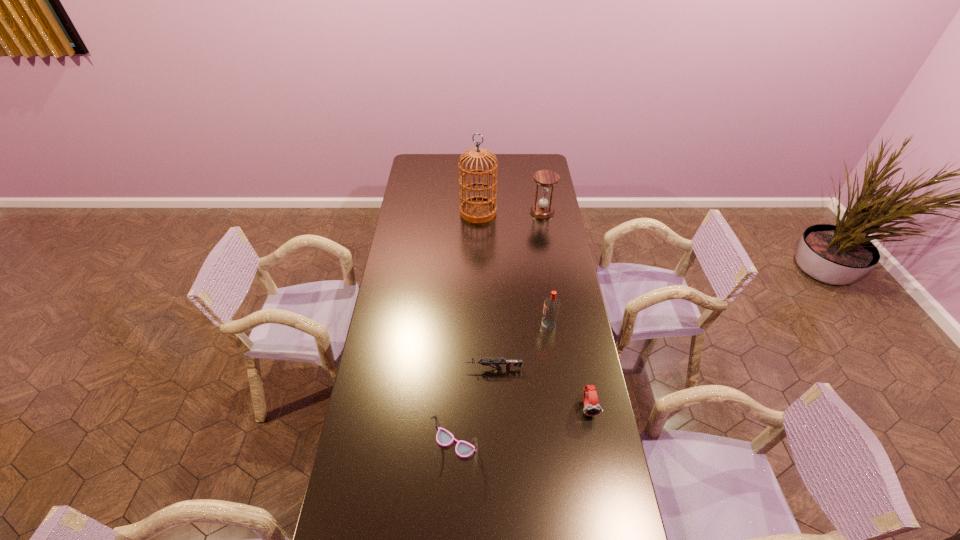
Where is `the tallest object`? This screenshot has height=540, width=960. the tallest object is located at coordinates (476, 209).

Where is `hourglass`? Image resolution: width=960 pixels, height=540 pixels. hourglass is located at coordinates (546, 179).

The height and width of the screenshot is (540, 960). I want to click on vodka, so click(551, 304).

The height and width of the screenshot is (540, 960). I want to click on the fourth tallest object, so click(444, 438).

At what (x,y) coordinates should I click in order to perform the action: click on the nearest object. Please return your answer as a coordinate pair (x, y). The image size is (960, 540). Looking at the image, I should click on (444, 438).

In order to click on the fifth tallest object in this screenshot , I will do `click(591, 405)`.

Identify the location of the second nearest object. This screenshot has height=540, width=960. (591, 405).

Where is `the third nearest object`? The width and height of the screenshot is (960, 540). the third nearest object is located at coordinates (508, 363).

The height and width of the screenshot is (540, 960). I want to click on gun, so click(x=508, y=363).

Where is `blank space located on the back of the birdcage`? blank space located on the back of the birdcage is located at coordinates (478, 172).